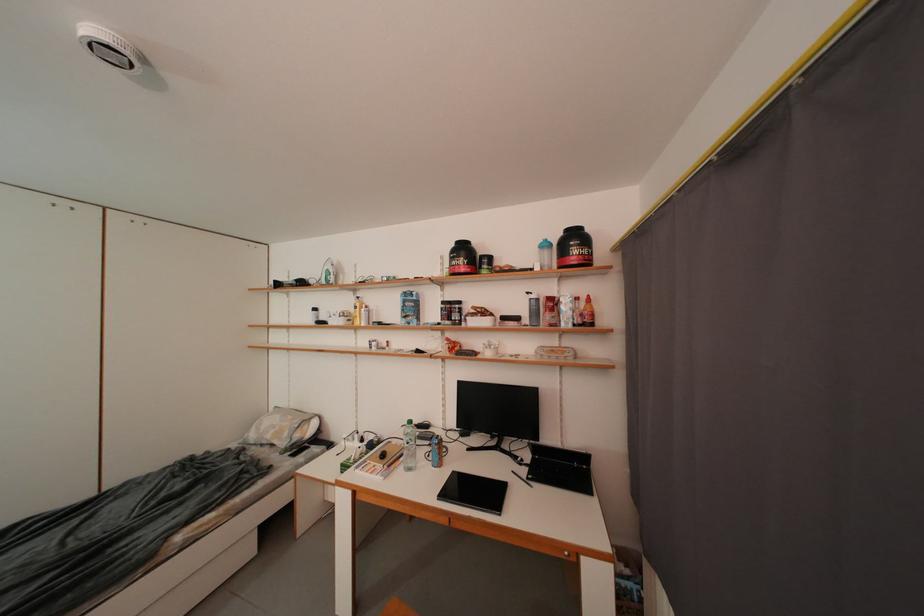
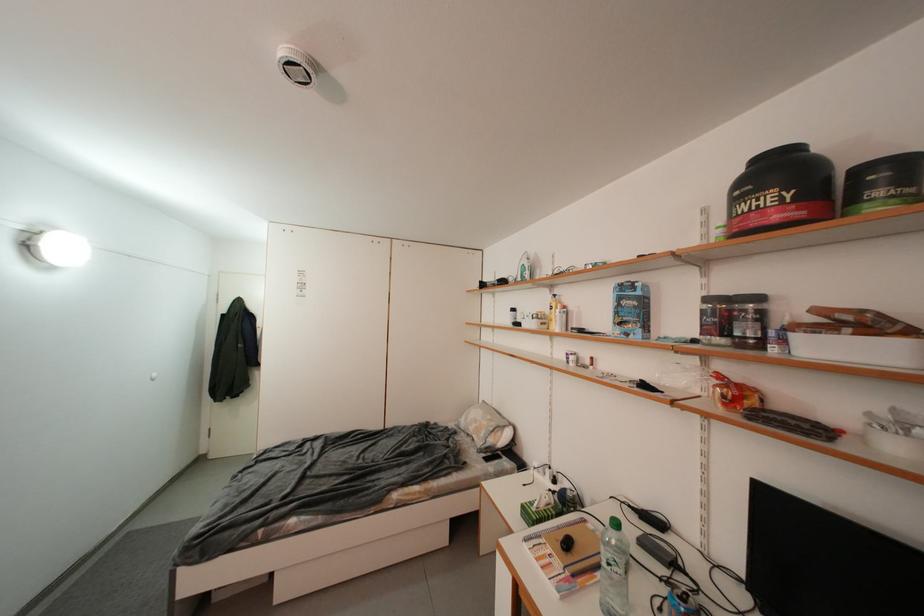
In the second image, find the point that corresponds to point (457, 355) in the first image.

(733, 408)